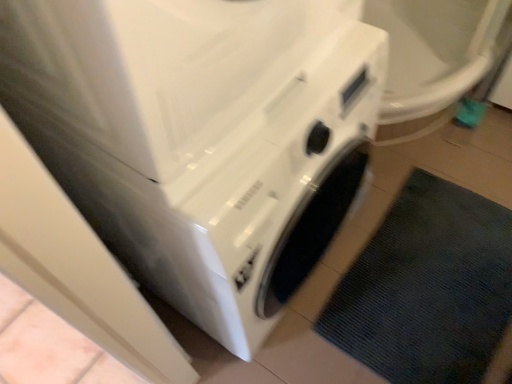
Measure the distance between point (146, 140) and camera.

Point (146, 140) and camera are 20.87 inches apart.

You are a GUI agent. You are given a task and a screenshot of the screen. Output one action in this format:
    pyautogui.click(x=<x>, y=<y>)
    Task: Click on the white glossy washing machine at center
    
    Given the screenshot: What is the action you would take?
    pyautogui.click(x=201, y=137)

What is the approximate height of white glossy washing machine at center?

33.61 inches.

The width and height of the screenshot is (512, 384). What do you see at coordinates (201, 137) in the screenshot?
I see `white glossy washing machine at center` at bounding box center [201, 137].

What is the approximate height of dark gray textured bath mat at lower right?

dark gray textured bath mat at lower right is 1.33 inches in height.

The image size is (512, 384). I want to click on dark gray textured bath mat at lower right, so click(426, 287).

What do you see at coordinates (426, 287) in the screenshot? I see `dark gray textured bath mat at lower right` at bounding box center [426, 287].

At what (x,y) coordinates should I click in order to perform the action: click on white glossy washing machine at center. Please return your answer as a coordinate pair (x, y). The image size is (512, 384). Looking at the image, I should click on (201, 137).

Does white glossy washing machine at center appear on the right side of dark gray textured bath mat at lower right?

No, white glossy washing machine at center is not to the right of dark gray textured bath mat at lower right.

Is white glossy washing machine at center in front of dark gray textured bath mat at lower right?

That is True.

Considering the positions of point (127, 112) and point (447, 356), is point (127, 112) closer or farther from the camera than point (447, 356)?

Point (127, 112) appears to be closer to the viewer than point (447, 356).

From the image's perspective, between white glossy washing machine at center and dark gray textured bath mat at lower right, who is located below?

From the image's view, dark gray textured bath mat at lower right is below.

From a real-world perspective, is white glossy washing machine at center located beneath dark gray textured bath mat at lower right?

Incorrect, from a real-world perspective, white glossy washing machine at center is higher than dark gray textured bath mat at lower right.

Is white glossy washing machine at center wider than dark gray textured bath mat at lower right?

Incorrect, the width of white glossy washing machine at center does not surpass that of dark gray textured bath mat at lower right.

Considering the sizes of objects white glossy washing machine at center and dark gray textured bath mat at lower right in the image provided, who is shorter, white glossy washing machine at center or dark gray textured bath mat at lower right?

dark gray textured bath mat at lower right is shorter.

Which of these two, white glossy washing machine at center or dark gray textured bath mat at lower right, is smaller?

dark gray textured bath mat at lower right is smaller.

Is white glossy washing machine at center not inside dark gray textured bath mat at lower right?

Yes, white glossy washing machine at center is located beyond the bounds of dark gray textured bath mat at lower right.

Can you see white glossy washing machine at center touching dark gray textured bath mat at lower right?

No, white glossy washing machine at center is not with dark gray textured bath mat at lower right.

Is white glossy washing machine at center facing towards dark gray textured bath mat at lower right?

Yes, white glossy washing machine at center is turned towards dark gray textured bath mat at lower right.

How different are the orientations of white glossy washing machine at center and dark gray textured bath mat at lower right in degrees?

The facing directions of white glossy washing machine at center and dark gray textured bath mat at lower right are 89.8 degrees apart.

How far apart are white glossy washing machine at center and dark gray textured bath mat at lower right?

white glossy washing machine at center and dark gray textured bath mat at lower right are 64.69 centimeters apart.

The height and width of the screenshot is (384, 512). Find the location of `washing machine in front of the dark gray textured bath mat at lower right`. washing machine in front of the dark gray textured bath mat at lower right is located at coordinates (201, 137).

Is dark gray textured bath mat at lower right to the right of white glossy washing machine at center from the viewer's perspective?

Yes.

Consider the image. Which object is closer to the camera, dark gray textured bath mat at lower right or white glossy washing machine at center?

Positioned in front is white glossy washing machine at center.

Considering the points (488, 208) and (315, 60), which point is in front, point (488, 208) or point (315, 60)?

The point (315, 60) is in front.

From the image's perspective, which object appears higher, dark gray textured bath mat at lower right or white glossy washing machine at center?

white glossy washing machine at center appears higher in the image.

From the picture: From a real-world perspective, relative to white glossy washing machine at center, is dark gray textured bath mat at lower right vertically above or below?

From a real-world perspective, dark gray textured bath mat at lower right is physically below white glossy washing machine at center.

Between dark gray textured bath mat at lower right and white glossy washing machine at center, which one has smaller width?

Thinner between the two is white glossy washing machine at center.

Considering the sizes of dark gray textured bath mat at lower right and white glossy washing machine at center in the image, is dark gray textured bath mat at lower right taller or shorter than white glossy washing machine at center?

dark gray textured bath mat at lower right is shorter than white glossy washing machine at center.

Considering the sizes of dark gray textured bath mat at lower right and white glossy washing machine at center in the image, is dark gray textured bath mat at lower right bigger or smaller than white glossy washing machine at center?

In the image, dark gray textured bath mat at lower right appears to be smaller than white glossy washing machine at center.

Can white glossy washing machine at center be found inside dark gray textured bath mat at lower right?

No, white glossy washing machine at center is not surrounded by dark gray textured bath mat at lower right.

Is dark gray textured bath mat at lower right in contact with white glossy washing machine at center?

There is a gap between dark gray textured bath mat at lower right and white glossy washing machine at center.

Could you tell me if dark gray textured bath mat at lower right is facing white glossy washing machine at center?

No, dark gray textured bath mat at lower right is not aimed at white glossy washing machine at center.

Can you tell me how much dark gray textured bath mat at lower right and white glossy washing machine at center differ in facing direction?

dark gray textured bath mat at lower right and white glossy washing machine at center are facing 89.8 degrees away from each other.

Locate an element on the screen. Image resolution: width=512 pixels, height=384 pixels. washing machine in front of the dark gray textured bath mat at lower right is located at coordinates (201, 137).

The width and height of the screenshot is (512, 384). I want to click on bath mat below the white glossy washing machine at center (from the image's perspective), so click(x=426, y=287).

At what (x,y) coordinates should I click in order to perform the action: click on bath mat below the white glossy washing machine at center (from a real-world perspective). Please return your answer as a coordinate pair (x, y). Looking at the image, I should click on (426, 287).